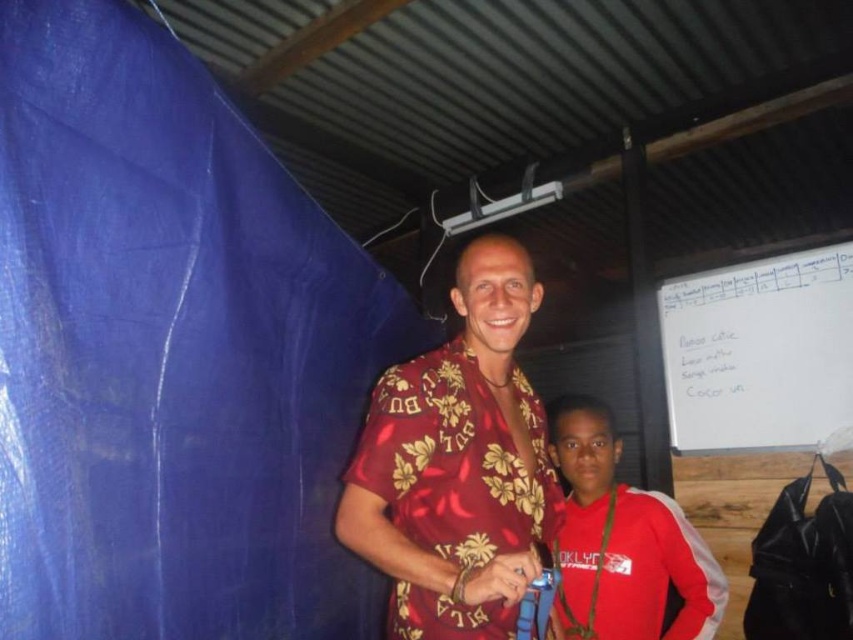
You are a photographer standing at the entrance of the space. You want to take a photo that includes both the shiny silk shirt at center and the red satin jacket at lower right. Which object should you adjust to ensure both are fully visible in the frame?

The shiny silk shirt at center is in front of the red satin jacket at lower right. To ensure both are fully visible, you should adjust the position of the shiny silk shirt at center so it doesn not block the view of the red satin jacket at lower right.

Based on the photo, you are an observer in the scene. You notice two clothing items, the shiny silk shirt at center and the red satin jacket at lower right. Which clothing item is narrower in width?

The shiny silk shirt at center is thinner than the red satin jacket at lower right, so the shiny silk shirt at center is narrower in width.